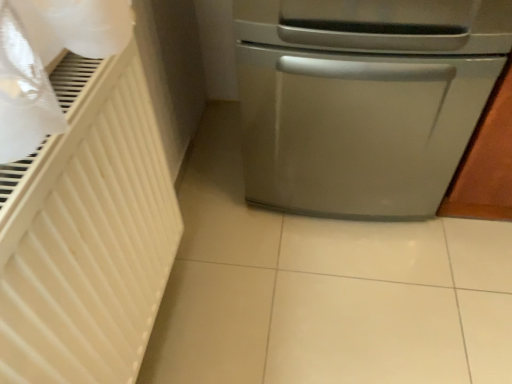
Question: Considering the positions of white matte radiator at left and satin silver dishwasher at right in the image, is white matte radiator at left bigger or smaller than satin silver dishwasher at right?

Choices:
 (A) small
 (B) big

Answer: (A)

Question: From a real-world perspective, relative to satin silver dishwasher at right, is white matte radiator at left vertically above or below?

Choices:
 (A) below
 (B) above

Answer: (B)

Question: Looking at their shapes, would you say white matte radiator at left is wider or thinner than satin silver dishwasher at right?

Choices:
 (A) thin
 (B) wide

Answer: (A)

Question: Is point (386, 130) closer or farther from the camera than point (47, 264)?

Choices:
 (A) closer
 (B) farther

Answer: (B)

Question: From the image's perspective, relative to white matte radiator at left, is satin silver dishwasher at right above or below?

Choices:
 (A) above
 (B) below

Answer: (A)

Question: Is satin silver dishwasher at right to the left or to the right of white matte radiator at left in the image?

Choices:
 (A) right
 (B) left

Answer: (A)

Question: Looking at their shapes, would you say satin silver dishwasher at right is wider or thinner than white matte radiator at left?

Choices:
 (A) wide
 (B) thin

Answer: (A)